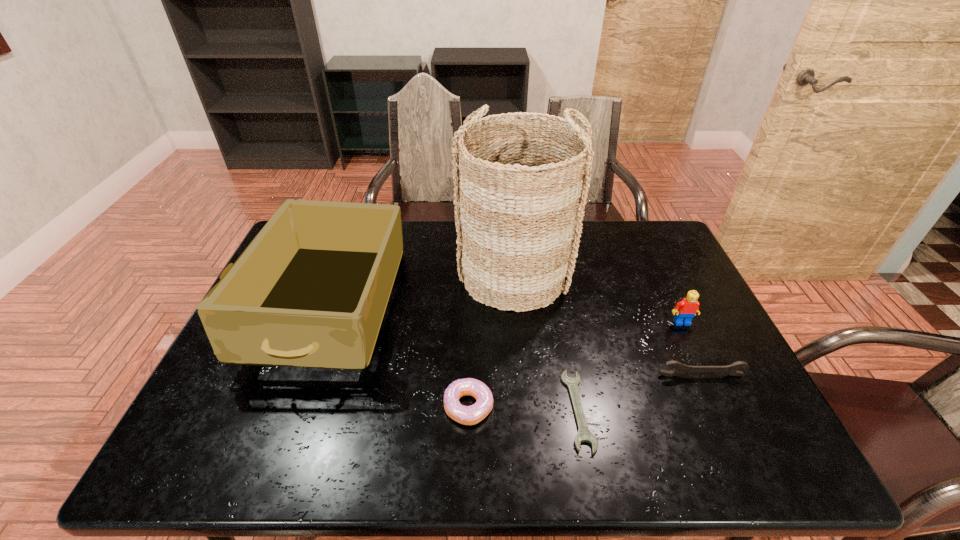
Where is `vacant point located between the left wrench and the right wrench`? This screenshot has height=540, width=960. vacant point located between the left wrench and the right wrench is located at coordinates [639, 393].

This screenshot has width=960, height=540. What are the coordinates of `blank region between the doughnut and the second tallest object` in the screenshot? It's located at (398, 357).

The width and height of the screenshot is (960, 540). I want to click on vacant space that is in between the tallest object and the taller wrench, so click(608, 324).

Locate an element on the screen. The height and width of the screenshot is (540, 960). vacant space in between the taller wrench and the shortest object is located at coordinates (639, 393).

You are a GUI agent. You are given a task and a screenshot of the screen. Output one action in this format:
    pyautogui.click(x=<x>, y=<y>)
    Task: Click on the empty location between the taller wrench and the shortest object
    This screenshot has width=960, height=540.
    Given the screenshot: What is the action you would take?
    pyautogui.click(x=639, y=393)

Locate which object ranks third in proximity to the Lego. Please provide its 2D coordinates. Your answer should be formatted as a tuple, i.e. [(x, y)], where the tuple contains the x and y coordinates of a point satisfying the conditions above.

[(584, 435)]

Locate an element on the screen. the fourth closest object relative to the shorter wrench is located at coordinates (686, 309).